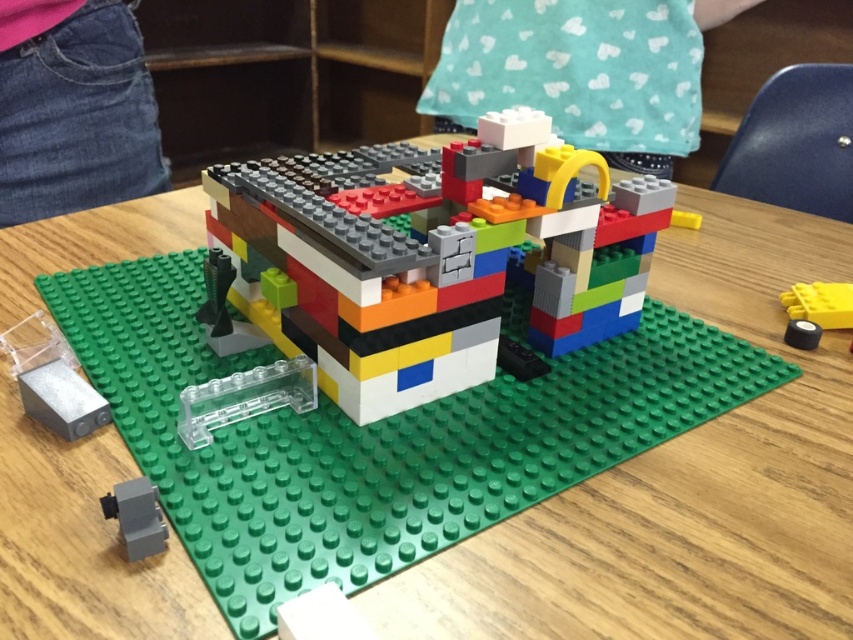
Question: Which point is closer to the camera?

Choices:
 (A) (7, 3)
 (B) (572, 160)
 (C) (648, 68)
 (D) (808, 312)

Answer: (B)

Question: Can you confirm if multicolored plastic toy at center is positioned to the left of denim jeans at lower left?

Choices:
 (A) no
 (B) yes

Answer: (A)

Question: Can you confirm if white matte shirt at upper center is positioned to the right of denim jeans at lower left?

Choices:
 (A) yes
 (B) no

Answer: (A)

Question: Which of the following is the closest to the observer?

Choices:
 (A) white matte shirt at upper center
 (B) multicolored plastic toy at center
 (C) yellow matte brick at lower right
 (D) denim jeans at lower left

Answer: (B)

Question: Is denim jeans at lower left closer to camera compared to yellow matte brick at lower right?

Choices:
 (A) yes
 (B) no

Answer: (B)

Question: Among these objects, which one is farthest from the camera?

Choices:
 (A) denim jeans at lower left
 (B) multicolored plastic toy at center
 (C) yellow matte brick at lower right

Answer: (A)